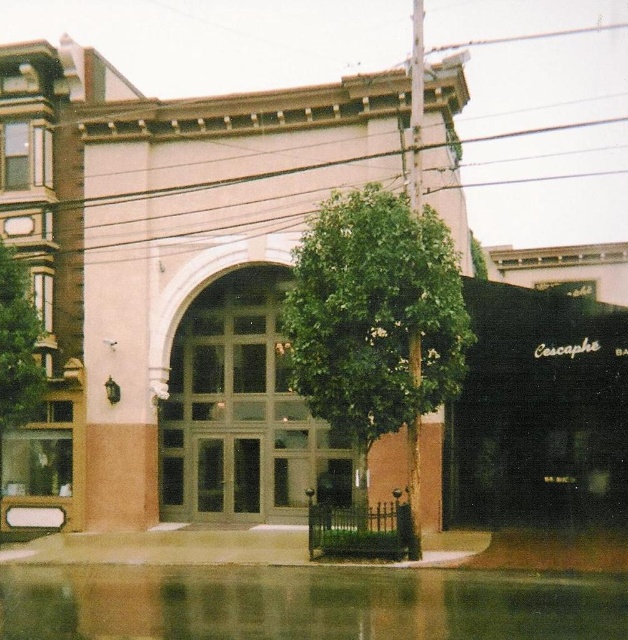
You are a landscape architect planning to place a bench between the green leafy tree at center and the green leafy tree at left. The bench is 6 feet long. Will there be enough space between the two trees to place the bench?

The distance between the green leafy tree at center and the green leafy tree at left is 20.96 feet, which is more than enough to accommodate a 6 feet long bench.

You are standing in front of the building and want to take a photo. The two points, point (455, 262) and point (0, 296), are part of the structure. Which point is closer to your camera lens?

Point (455, 262) is closer to the viewer than point (0, 296), so it will appear closer to the camera lens.

You are standing in front of the building and want to take a photo of the entrance. Which tree, the green leafy tree at center or the green leafy tree at left, is blocking your view more?

The green leafy tree at center is closer to the viewer than the green leafy tree at left, so it is blocking your view more.